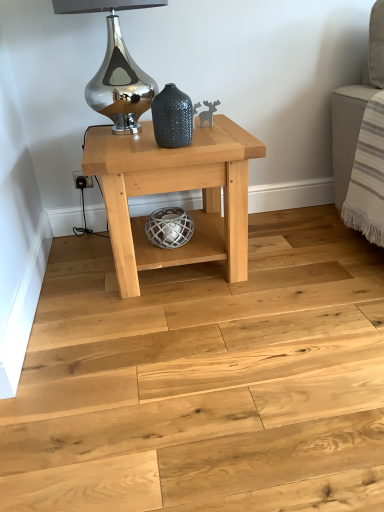
Question: Is the depth of natural wood floor at center less than that of natural wood table at center?

Choices:
 (A) no
 (B) yes

Answer: (B)

Question: Can you confirm if natural wood floor at center is bigger than natural wood table at center?

Choices:
 (A) no
 (B) yes

Answer: (A)

Question: Is natural wood table at center surrounded by natural wood floor at center?

Choices:
 (A) no
 (B) yes

Answer: (A)

Question: From the image's perspective, is natural wood floor at center located above natural wood table at center?

Choices:
 (A) no
 (B) yes

Answer: (A)

Question: Can you confirm if natural wood floor at center is thinner than natural wood table at center?

Choices:
 (A) yes
 (B) no

Answer: (B)

Question: Is natural wood floor at center placed right next to natural wood table at center?

Choices:
 (A) no
 (B) yes

Answer: (A)

Question: From a real-world perspective, is natural wood table at center on shiny metallic table lamp at upper center?

Choices:
 (A) yes
 (B) no

Answer: (B)

Question: Is natural wood table at center further to the viewer compared to shiny metallic table lamp at upper center?

Choices:
 (A) yes
 (B) no

Answer: (A)

Question: Can you confirm if natural wood table at center is thinner than shiny metallic table lamp at upper center?

Choices:
 (A) no
 (B) yes

Answer: (A)

Question: Considering the relative sizes of natural wood table at center and shiny metallic table lamp at upper center in the image provided, is natural wood table at center smaller than shiny metallic table lamp at upper center?

Choices:
 (A) no
 (B) yes

Answer: (A)

Question: Does natural wood table at center have a larger size compared to shiny metallic table lamp at upper center?

Choices:
 (A) no
 (B) yes

Answer: (B)

Question: Considering the relative positions of natural wood table at center and shiny metallic table lamp at upper center in the image provided, is natural wood table at center to the left of shiny metallic table lamp at upper center from the viewer's perspective?

Choices:
 (A) no
 (B) yes

Answer: (A)

Question: Does natural wood floor at center lie behind textured dark gray vase at center?

Choices:
 (A) yes
 (B) no

Answer: (B)